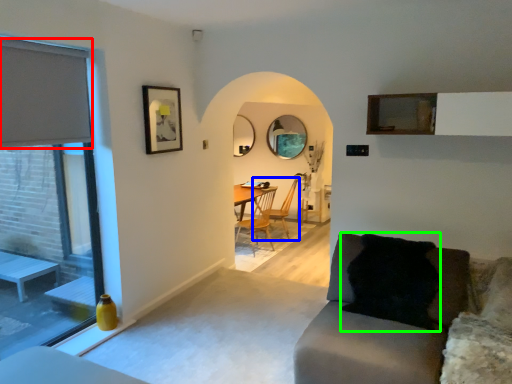
Question: Which is nearer to the curtain (highlighted by a red box)? chair (highlighted by a blue box) or pillow (highlighted by a green box).

Choices:
 (A) chair
 (B) pillow

Answer: (B)